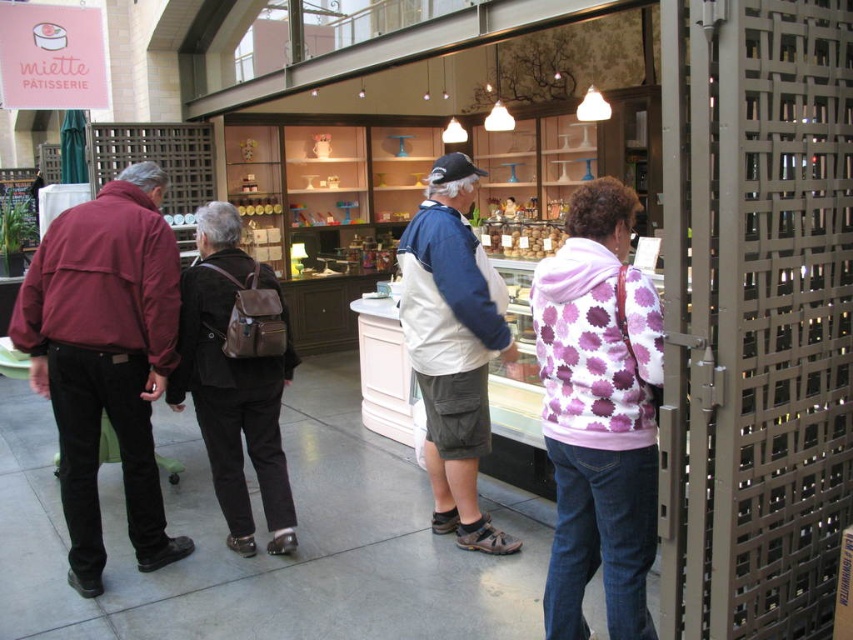
You are a store employee who needs to retrieve a customer order located between the purple dotted hoodie at center and the maroon fabric jacket at left. Can you reach the item without moving either of the garments?

The distance between the purple dotted hoodie at center and the maroon fabric jacket at left is 6.74 feet, which is a considerable space. Therefore, you can easily reach the item without needing to move either garment.

You are a customer at Miette Patisserie and want to place your purple dotted hoodie at center and brown leather backpack at center on the counter. Which item should you place first if you want to put the smaller one closer to the edge of the counter?

The purple dotted hoodie at center is smaller than the brown leather backpack at center, so you should place the purple dotted hoodie at center first to have it closer to the edge of the counter.

In the scene shown: You are a customer at Miette Patisserie and notice a maroon fabric jacket at left. Where exactly is the maroon fabric jacket located in the scene?

The maroon fabric jacket at left is located at point (105, 356).